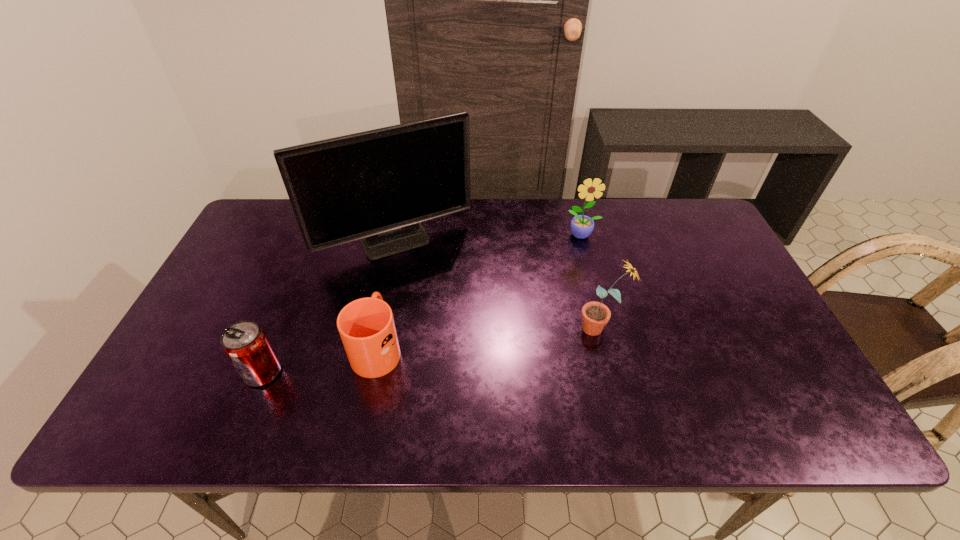
Where is `free point between the mug and the nearer sunflower`? free point between the mug and the nearer sunflower is located at coordinates (489, 338).

The width and height of the screenshot is (960, 540). Find the location of `free space between the tallest object and the farther sunflower`. free space between the tallest object and the farther sunflower is located at coordinates (490, 239).

Select which object appears as the fourth closest to the mug. Please provide its 2D coordinates. Your answer should be formatted as a tuple, i.e. [(x, y)], where the tuple contains the x and y coordinates of a point satisfying the conditions above.

[(581, 226)]

Identify which object is the second nearest to the pop soda. Please provide its 2D coordinates. Your answer should be formatted as a tuple, i.e. [(x, y)], where the tuple contains the x and y coordinates of a point satisfying the conditions above.

[(377, 186)]

Identify the location of vacant region that satisfies the following two spatial constraints: 1. on the front-facing side of the farther sunflower; 2. on the flower of the nearer sunflower. (606, 327).

This screenshot has width=960, height=540. Find the location of `free space in the image that satisfies the following two spatial constraints: 1. on the flower of the nearer sunflower; 2. on the front side of the pop soda`. free space in the image that satisfies the following two spatial constraints: 1. on the flower of the nearer sunflower; 2. on the front side of the pop soda is located at coordinates (611, 373).

Find the location of a particular element. The height and width of the screenshot is (540, 960). free space that satisfies the following two spatial constraints: 1. on the front-facing side of the farther sunflower; 2. on the flower of the nearer sunflower is located at coordinates (606, 327).

Locate an element on the screen. Image resolution: width=960 pixels, height=540 pixels. vacant position in the image that satisfies the following two spatial constraints: 1. on the front-facing side of the farther sunflower; 2. on the flower of the nearer sunflower is located at coordinates (606, 327).